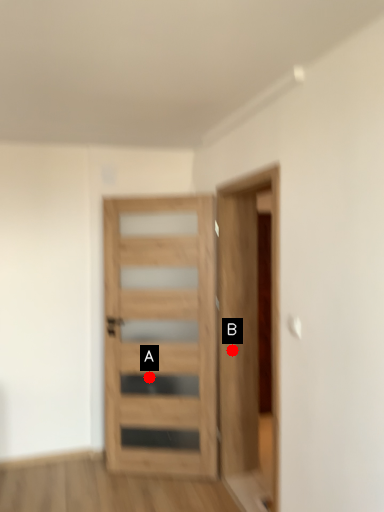
Question: Two points are circled on the image, labeled by A and B beside each circle. Which point is further to the camera?

Choices:
 (A) A is further
 (B) B is further

Answer: (A)